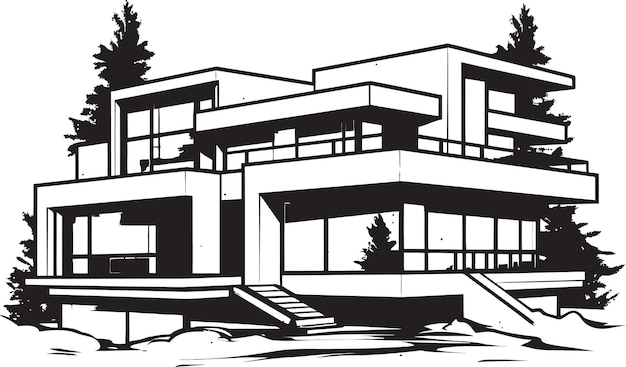
The width and height of the screenshot is (626, 367). In order to click on windows in this screenshot , I will do `click(172, 138)`, `click(166, 122)`, `click(136, 125)`, `click(141, 152)`, `click(108, 232)`, `click(426, 239)`, `click(349, 231)`, `click(501, 105)`, `click(496, 144)`.